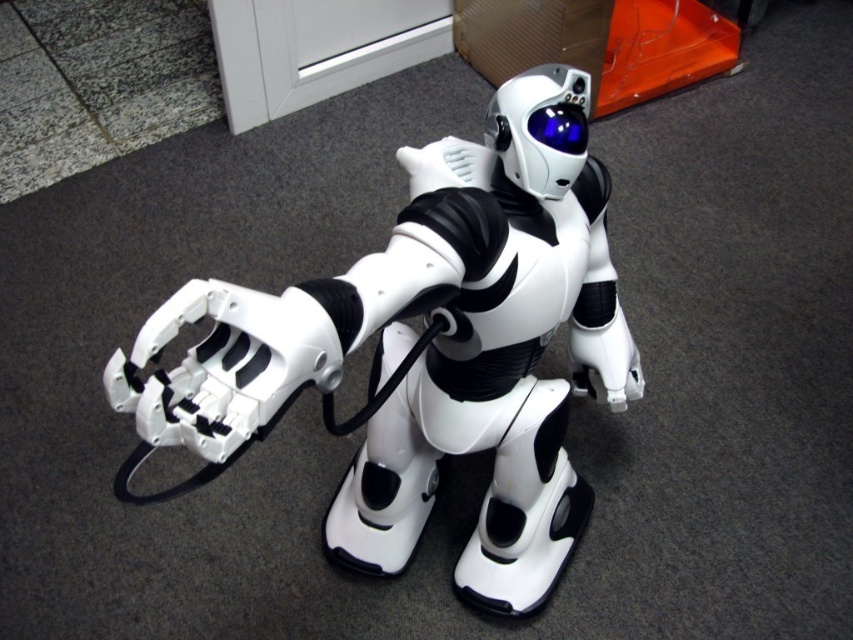
You are a delivery person who needs to scan a QR code located on the white matte robot at center. Your scanner has a maximum scanning range of 20 inches. Can you scan the QR code without moving closer?

The white matte robot at center is 22.69 inches away from camera, which is beyond the scanner maximum scanning range of 20 inches. You need to move closer to scan the QR code.

You are a technician in an office and need to locate a specific point on the robot. The point is at coordinates point (422,355). Which object in the scene does this point belong to?

The point (422,355) is on the white matte robot at center.

You are a technician in a lab and need to place a tool on the white matte robot at center. However, the glossy plastic goggles at upper center are blocking the way. Can you move the goggles to the right side of the robot to make space?

The white matte robot at center is positioned on the left side of the glossy plastic goggles at upper center, so moving the goggles to the right side of the robot would require shifting them to the robot s right side, which is currently unoccupied. Yes, you can move the glossy plastic goggles at upper center to the right side of the white matte robot at center to create space.